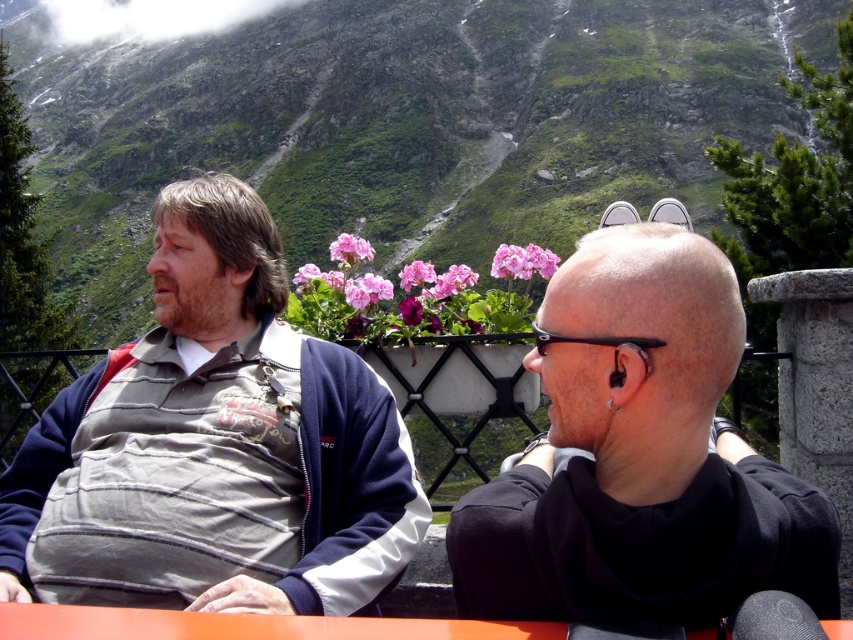
Question: Which of the following is the farthest from the observer?

Choices:
 (A) coord(71,394)
 (B) coord(635,250)

Answer: (A)

Question: Which point is farther to the camera?

Choices:
 (A) black matte hair at center
 (B) gray striped shirt at left

Answer: (B)

Question: Can you confirm if gray striped shirt at left is positioned below black matte hair at center?

Choices:
 (A) no
 (B) yes

Answer: (A)

Question: Can you confirm if gray striped shirt at left is bigger than black matte hair at center?

Choices:
 (A) yes
 (B) no

Answer: (A)

Question: Does gray striped shirt at left appear on the left side of black matte hair at center?

Choices:
 (A) yes
 (B) no

Answer: (A)